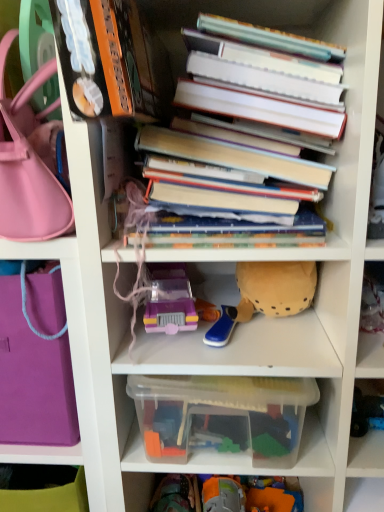
Question: Is matte pink handbag at left, positioned as the 2th handbag in bottom-to-top order, completely or partially outside of soft yellow plush at center, acting as the 1th toy starting from the right?

Choices:
 (A) yes
 (B) no

Answer: (A)

Question: From the image's perspective, is matte pink handbag at left, positioned as the 2th handbag in bottom-to-top order, over soft yellow plush at center, acting as the 1th toy starting from the right?

Choices:
 (A) yes
 (B) no

Answer: (A)

Question: Could you tell me if matte pink handbag at left, which appears as the first handbag when viewed from the top, is facing soft yellow plush at center, marked as the 3th toy in a left-to-right arrangement?

Choices:
 (A) no
 (B) yes

Answer: (A)

Question: From the image's perspective, would you say matte pink handbag at left, positioned as the 2th handbag in bottom-to-top order, is shown under soft yellow plush at center, marked as the 3th toy in a left-to-right arrangement?

Choices:
 (A) no
 (B) yes

Answer: (A)

Question: Is matte pink handbag at left, positioned as the 2th handbag in bottom-to-top order, to the right of soft yellow plush at center, acting as the 1th toy starting from the right, from the viewer's perspective?

Choices:
 (A) no
 (B) yes

Answer: (A)

Question: Can you confirm if matte pink handbag at left, which appears as the first handbag when viewed from the top, is positioned to the left of soft yellow plush at center, acting as the 1th toy starting from the right?

Choices:
 (A) yes
 (B) no

Answer: (A)

Question: Would you consider soft yellow plush at center, acting as the 1th toy starting from the right, to be distant from translucent plastic toy car at center, positioned as the third toy in right-to-left order?

Choices:
 (A) yes
 (B) no

Answer: (B)

Question: Is soft yellow plush at center, acting as the 1th toy starting from the right, next to translucent plastic toy car at center, positioned as the third toy in right-to-left order?

Choices:
 (A) no
 (B) yes

Answer: (A)

Question: Considering the relative sizes of soft yellow plush at center, acting as the 1th toy starting from the right, and translucent plastic toy car at center, placed as the 1th toy when sorted from left to right, in the image provided, is soft yellow plush at center, acting as the 1th toy starting from the right, thinner than translucent plastic toy car at center, placed as the 1th toy when sorted from left to right,?

Choices:
 (A) yes
 (B) no

Answer: (B)

Question: From the image's perspective, is soft yellow plush at center, acting as the 1th toy starting from the right, under translucent plastic toy car at center, positioned as the third toy in right-to-left order?

Choices:
 (A) yes
 (B) no

Answer: (B)

Question: From a real-world perspective, is soft yellow plush at center, acting as the 1th toy starting from the right, under translucent plastic toy car at center, positioned as the third toy in right-to-left order?

Choices:
 (A) yes
 (B) no

Answer: (B)

Question: Considering the relative positions of soft yellow plush at center, acting as the 1th toy starting from the right, and translucent plastic toy car at center, positioned as the third toy in right-to-left order, in the image provided, is soft yellow plush at center, acting as the 1th toy starting from the right, behind translucent plastic toy car at center, positioned as the third toy in right-to-left order,?

Choices:
 (A) no
 (B) yes

Answer: (B)

Question: Does hardcover books at center have a lesser height compared to purple fabric bag at left, which is the first handbag in bottom-to-top order?

Choices:
 (A) no
 (B) yes

Answer: (A)